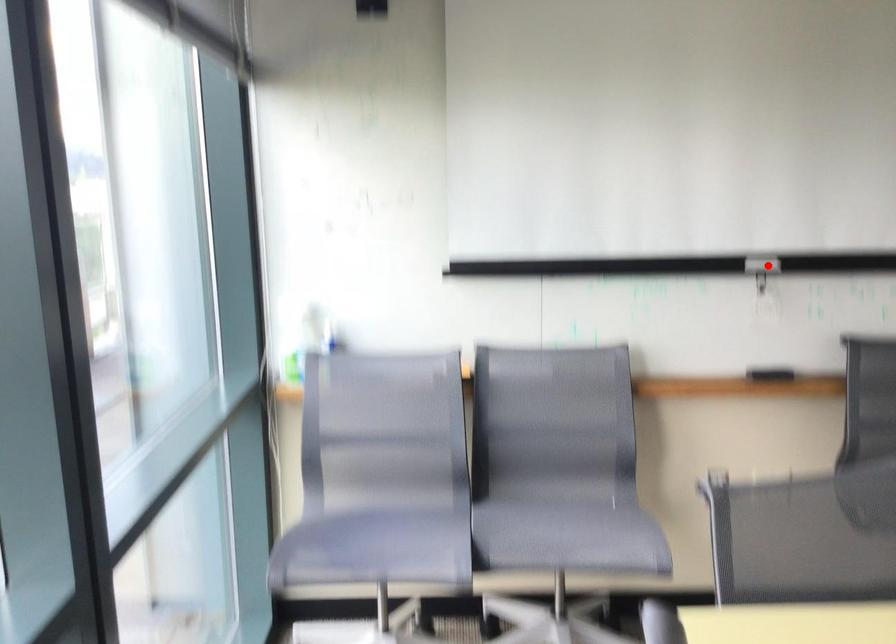
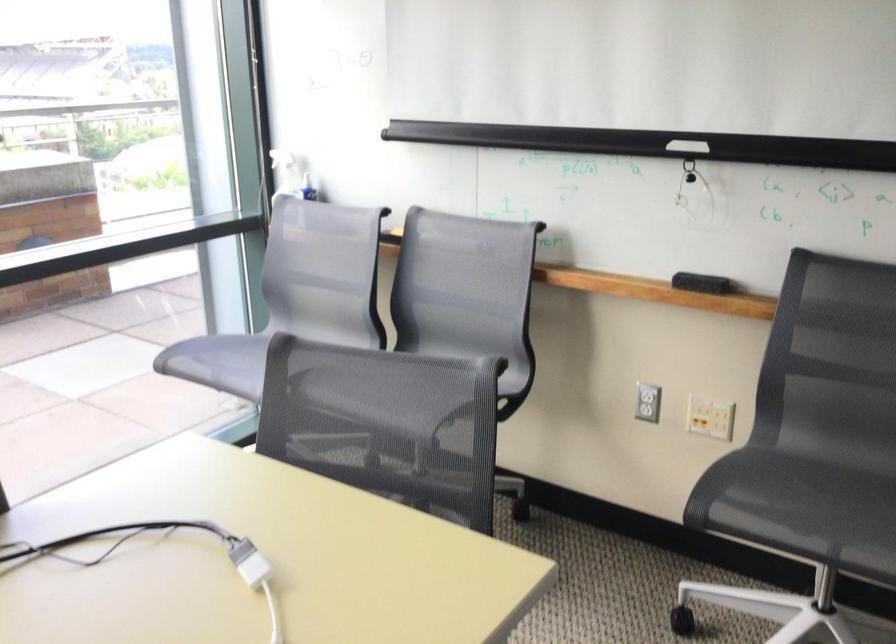
Question: I am providing you with two images of the same scene from different viewpoints. A red point is shown in image1. For the corresponding object point in image2, is it positioned nearer or farther from the camera?

Choices:
 (A) Nearer
 (B) Farther

Answer: (A)